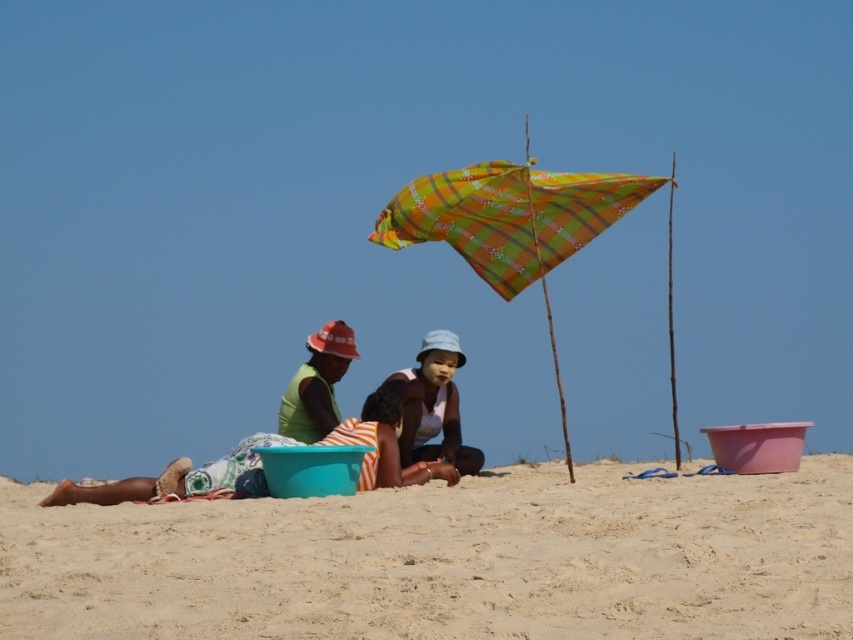
Question: Which point is farther to the camera?

Choices:
 (A) fine-grained sand at lower center
 (B) striped fabric child at center

Answer: (B)

Question: Is fine-grained sand at lower center smaller than light blue fabric hat at center?

Choices:
 (A) no
 (B) yes

Answer: (B)

Question: Can you confirm if fine-grained sand at lower center is smaller than light blue fabric hat at center?

Choices:
 (A) yes
 (B) no

Answer: (A)

Question: Estimate the real-world distances between objects in this image. Which object is farther from the striped fabric child at center?

Choices:
 (A) plaid fabric umbrella at center
 (B) green fabric shirt at center
 (C) light blue fabric hat at center
 (D) fine-grained sand at lower center

Answer: (D)

Question: Observing the image, what is the correct spatial positioning of light blue fabric hat at center in reference to striped fabric child at center?

Choices:
 (A) below
 (B) above

Answer: (B)

Question: Which object is farther from the camera taking this photo?

Choices:
 (A) green fabric shirt at center
 (B) light blue fabric hat at center

Answer: (A)